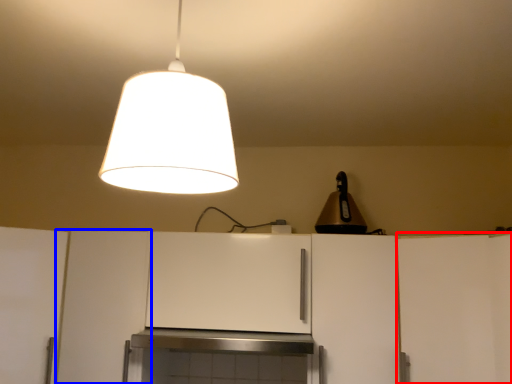
Question: Which of the following is the closest to the observer, cabinetry (highlighted by a red box) or cabinetry (highlighted by a blue box)?

Choices:
 (A) cabinetry
 (B) cabinetry

Answer: (A)